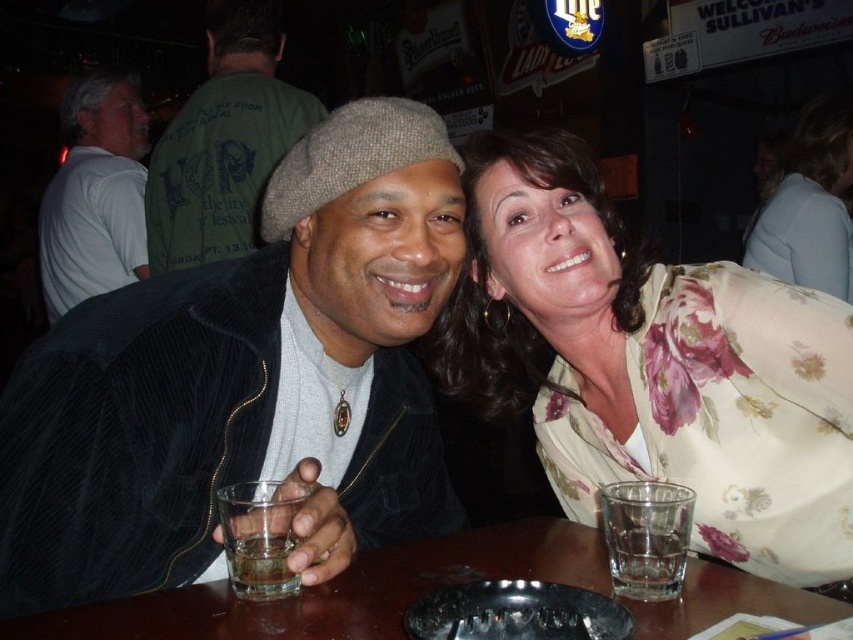
Is corduroy jacket at center bigger than floral silk blouse at upper right?

Yes.

Is corduroy jacket at center wider than floral silk blouse at upper right?

Incorrect, corduroy jacket at center's width does not surpass floral silk blouse at upper right's.

I want to click on corduroy jacket at center, so click(247, 381).

Can you confirm if corduroy jacket at center is positioned to the right of transparent glass at center?

In fact, corduroy jacket at center is to the left of transparent glass at center.

Can you confirm if corduroy jacket at center is shorter than transparent glass at center?

No.

Where is `corduroy jacket at center`? The height and width of the screenshot is (640, 853). corduroy jacket at center is located at coordinates (247, 381).

This screenshot has width=853, height=640. I want to click on corduroy jacket at center, so click(247, 381).

Which of these two, corduroy jacket at center or floral fabric blouse at upper right, stands taller?

floral fabric blouse at upper right

The height and width of the screenshot is (640, 853). Describe the element at coordinates (247, 381) in the screenshot. I see `corduroy jacket at center` at that location.

Where is `corduroy jacket at center`? The height and width of the screenshot is (640, 853). corduroy jacket at center is located at coordinates point(247,381).